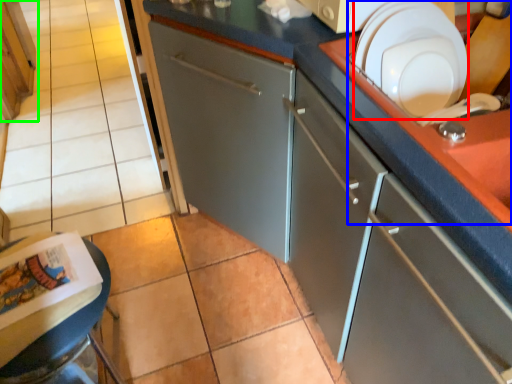
Question: Considering the real-world distances, which object is closest to tableware (highlighted by a red box)? sink (highlighted by a blue box) or cabinetry (highlighted by a green box).

Choices:
 (A) sink
 (B) cabinetry

Answer: (A)